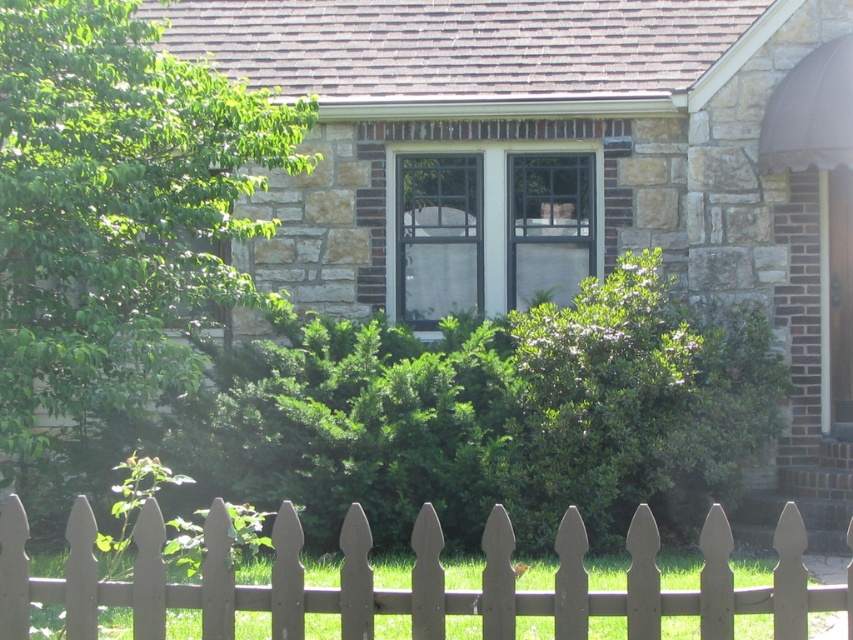
You are standing in front of a house and want to reach the clear glass window at center to clean it. Considering your ladder can extend up to 40 feet, will you be able to reach the window?

The clear glass window at center is 48.15 feet away from the viewer. Since the ladder can only extend up to 40 feet, you will not be able to reach the window.